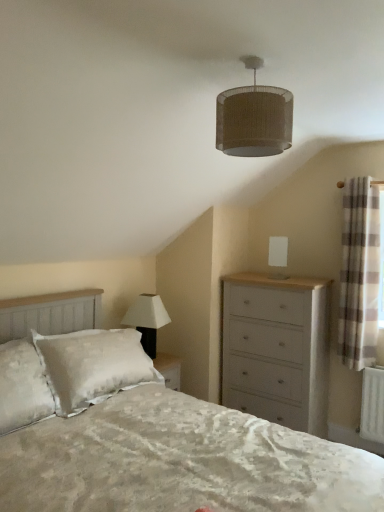
Question: Does white matte lampshade at upper center, which appears as the 1th lamp when viewed from the back, contain plaid fabric curtain at right?

Choices:
 (A) yes
 (B) no

Answer: (B)

Question: Does white matte lampshade at upper center, the second lamp in the top-to-bottom sequence, appear on the left side of plaid fabric curtain at right?

Choices:
 (A) yes
 (B) no

Answer: (A)

Question: Is white matte lampshade at upper center, the 2th lamp in the bottom-to-top sequence, located outside plaid fabric curtain at right?

Choices:
 (A) no
 (B) yes

Answer: (B)

Question: Can you confirm if white matte lampshade at upper center, the 2th lamp in the bottom-to-top sequence, is bigger than plaid fabric curtain at right?

Choices:
 (A) no
 (B) yes

Answer: (A)

Question: From the image's perspective, is white matte lampshade at upper center, which is the third lamp in front-to-back order, under plaid fabric curtain at right?

Choices:
 (A) yes
 (B) no

Answer: (A)

Question: Is white textured bed at center taller or shorter than white matte lampshade at upper center, the 2th lamp in the bottom-to-top sequence?

Choices:
 (A) short
 (B) tall

Answer: (B)

Question: Is white textured bed at center bigger or smaller than white matte lampshade at upper center, which is the third lamp in front-to-back order?

Choices:
 (A) small
 (B) big

Answer: (B)

Question: Relative to white matte lampshade at upper center, the 2th lamp in the bottom-to-top sequence, is white textured bed at center in front or behind?

Choices:
 (A) behind
 (B) front

Answer: (B)

Question: Considering the positions of white textured bed at center and white matte lampshade at upper center, the second lamp in the top-to-bottom sequence, in the image, is white textured bed at center wider or thinner than white matte lampshade at upper center, the second lamp in the top-to-bottom sequence,?

Choices:
 (A) thin
 (B) wide

Answer: (B)

Question: Looking at their shapes, would you say white matte lamp at upper center, the 2th lamp in the front-to-back sequence, is wider or thinner than plaid fabric curtain at right?

Choices:
 (A) wide
 (B) thin

Answer: (A)

Question: Considering their positions, is white matte lamp at upper center, acting as the second lamp starting from the back, located in front of or behind plaid fabric curtain at right?

Choices:
 (A) front
 (B) behind

Answer: (B)

Question: Would you say white matte lamp at upper center, acting as the second lamp starting from the back, is to the left or to the right of plaid fabric curtain at right in the picture?

Choices:
 (A) right
 (B) left

Answer: (B)

Question: Is point (137, 323) closer or farther from the camera than point (339, 333)?

Choices:
 (A) farther
 (B) closer

Answer: (B)

Question: From a real-world perspective, is white matte lamp at upper center, positioned as the 1th lamp in bottom-to-top order, positioned above or below white matte lampshade at upper center, which is the third lamp in front-to-back order?

Choices:
 (A) above
 (B) below

Answer: (B)

Question: Is point (167, 316) positioned closer to the camera than point (278, 240)?

Choices:
 (A) closer
 (B) farther

Answer: (A)